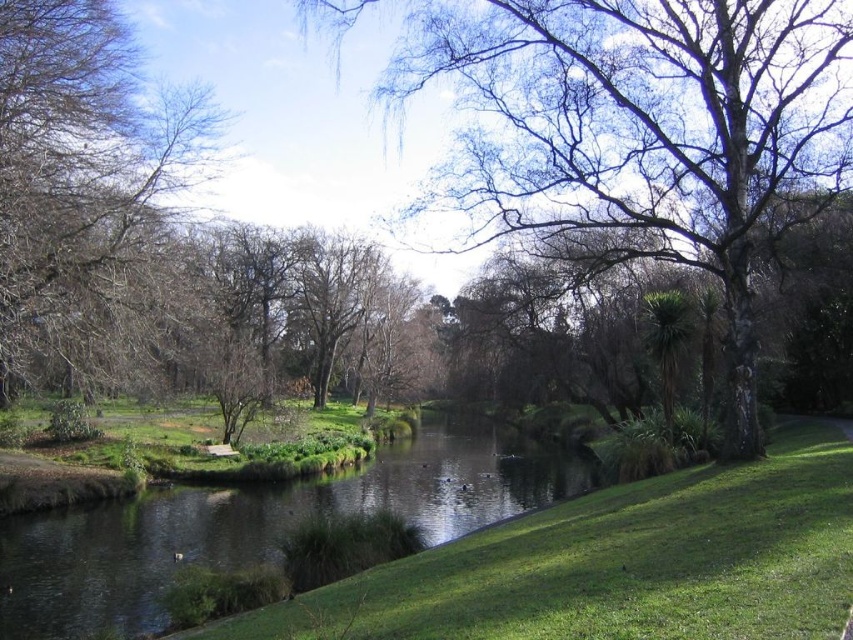
Question: Which object is positioned closest to the bare branches at center?

Choices:
 (A) brown leafy tree at left
 (B) green grassy river at center

Answer: (B)

Question: Among these objects, which one is farthest from the camera?

Choices:
 (A) brown leafy tree at left
 (B) green grassy river at center

Answer: (A)

Question: Is bare branches at center wider than brown leafy tree at left?

Choices:
 (A) no
 (B) yes

Answer: (B)

Question: Which point is farther from the camera taking this photo?

Choices:
 (A) (53, 172)
 (B) (70, 561)
 (C) (410, 52)

Answer: (A)

Question: In this image, where is green grassy river at center located relative to brown leafy tree at left?

Choices:
 (A) left
 (B) right

Answer: (B)

Question: Does bare branches at center appear over brown leafy tree at left?

Choices:
 (A) yes
 (B) no

Answer: (B)